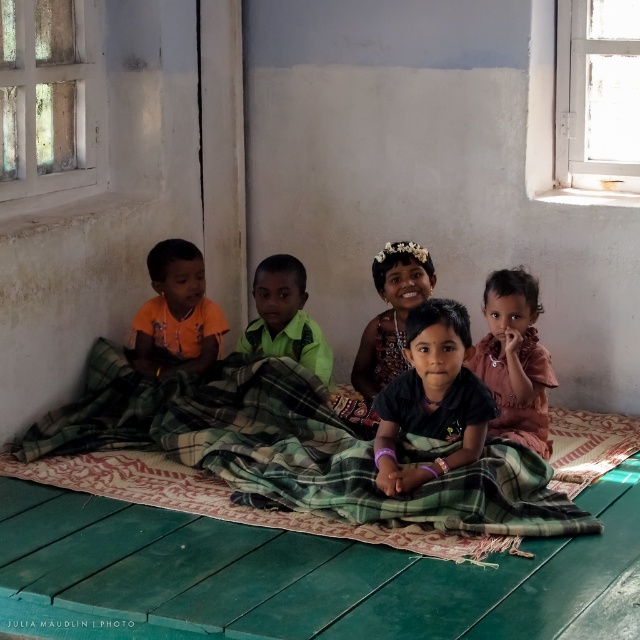
Question: Does green plaid blanket at center come behind green matte shirt at center?

Choices:
 (A) yes
 (B) no

Answer: (B)

Question: Which object is the farthest from the orange matte shirt at left?

Choices:
 (A) green plaid blanket at center
 (B) black fabric tiara at center

Answer: (B)

Question: Which point appears farthest from the camera in this image?

Choices:
 (A) (394, 376)
 (B) (486, 408)
 (C) (499, 413)

Answer: (A)

Question: From the image, what is the correct spatial relationship of matte floral headband at center in relation to green matte shirt at center?

Choices:
 (A) below
 (B) above

Answer: (B)

Question: Which point is farther to the camera?

Choices:
 (A) green matte shirt at center
 (B) orange matte shirt at left

Answer: (A)

Question: Does green plaid blanket at center have a greater width compared to dark green fabric at center?

Choices:
 (A) no
 (B) yes

Answer: (B)